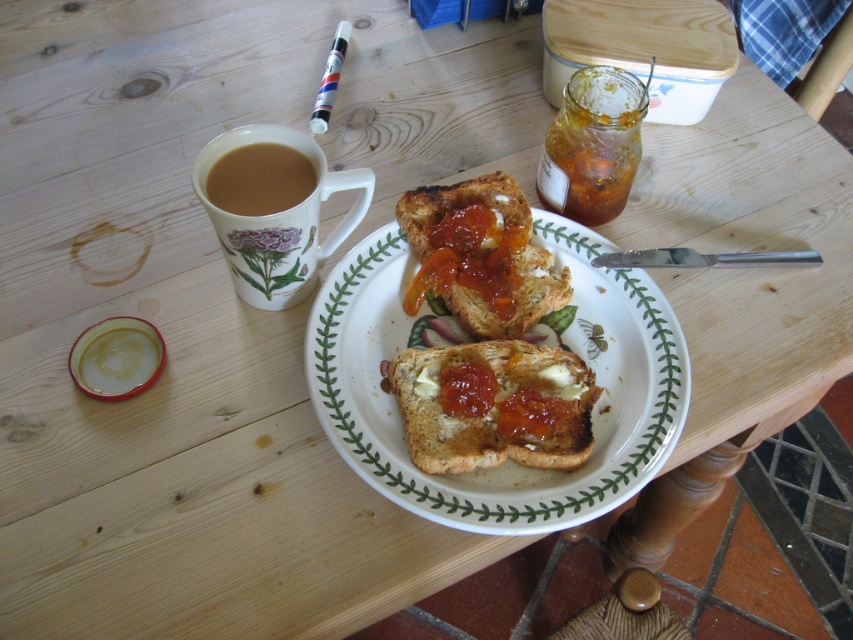
You are setting up a breakfast tray and need to arrange the golden brown toast at center and the translucent amber jam at upper right. Given their sizes, which item should you place first to ensure proper fitting on the plate?

The golden brown toast at center is bigger than the translucent amber jam at upper right, so you should place the golden brown toast at center first to ensure it fits properly on the plate.

You are setting up a breakfast tray and need to place both the golden brown toast at center and the translucent amber jam at upper right on the tray. The tray has a width of 10 cm. Based on their sizes, can both items fit side by side on the tray without overlapping?

The golden brown toast at center might be wider than the translucent amber jam at upper right. Since the tray is only 10 cm wide, it depends on their exact widths. If the toast is wider, their combined width might exceed the tray capacity, so they might not fit side by side.